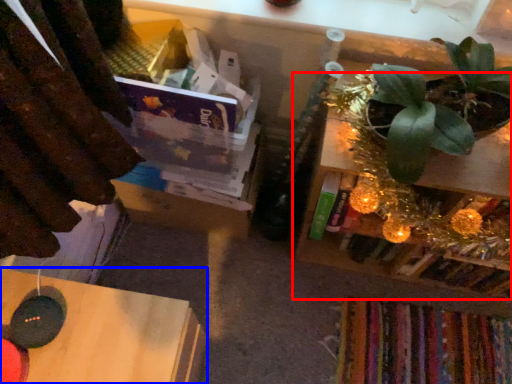
Question: Which point is further to the camera, shelf (highlighted by a red box) or table (highlighted by a blue box)?

Choices:
 (A) shelf
 (B) table

Answer: (A)